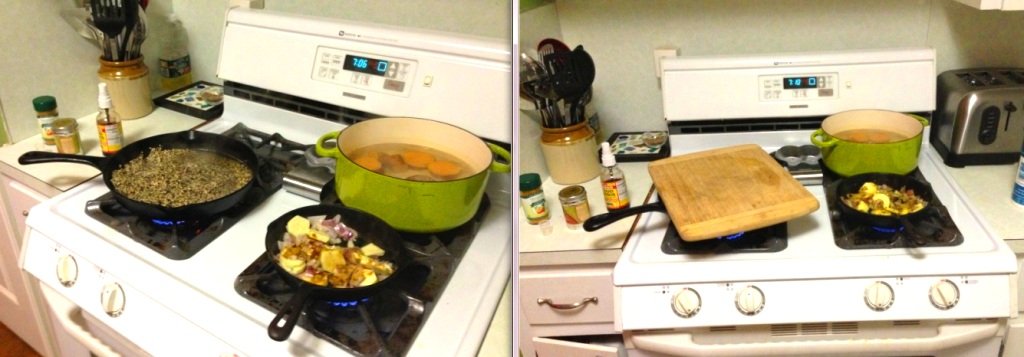
This screenshot has height=357, width=1024. I want to click on handle, so click(298, 302).